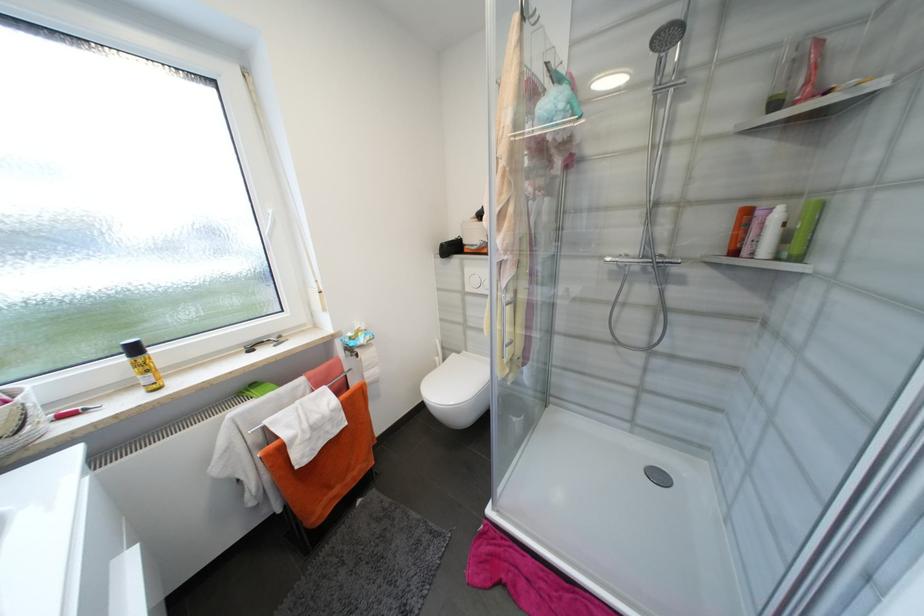
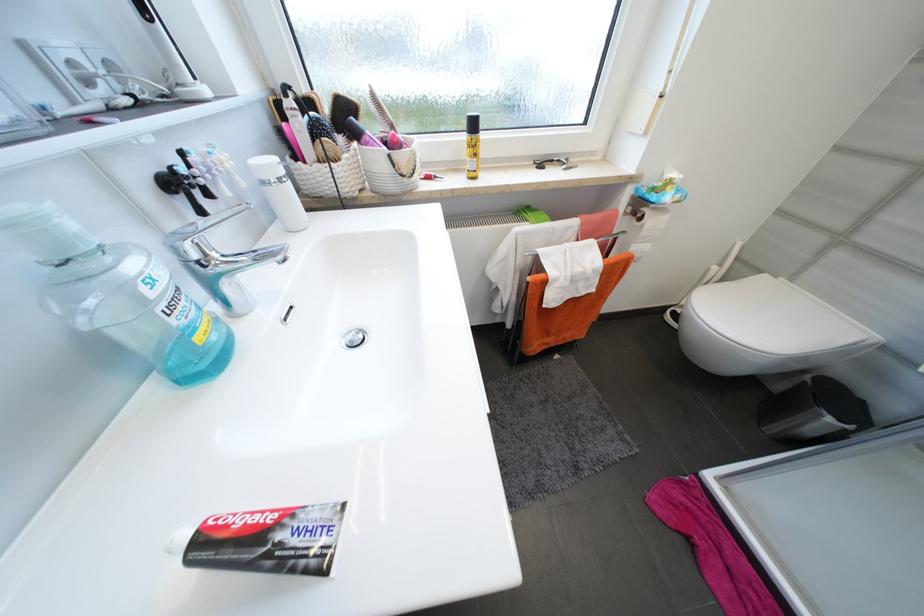
Find the pixel in the second image that matches (269,342) in the first image.

(558, 161)